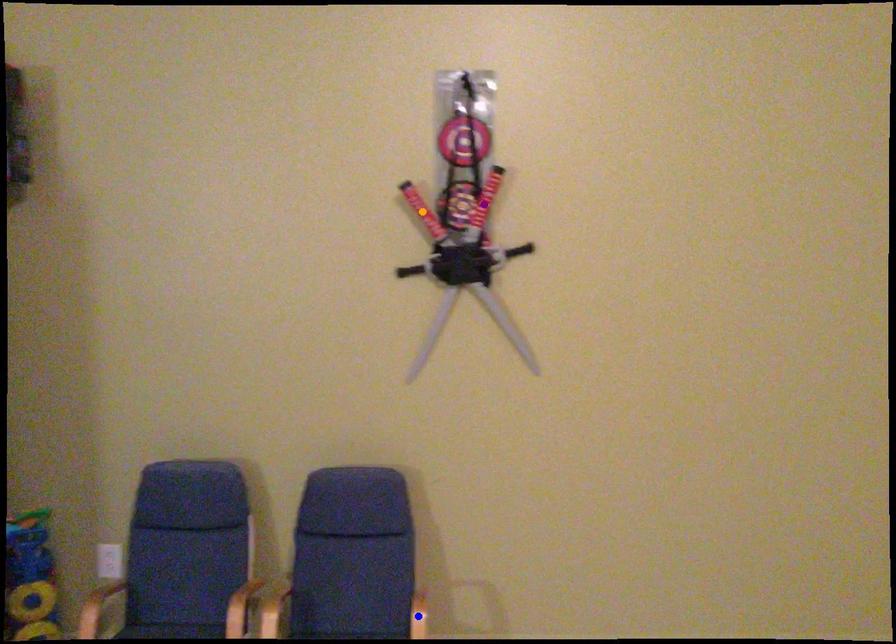
Order these from nearest to farthest:
purple point
orange point
blue point

blue point < purple point < orange point